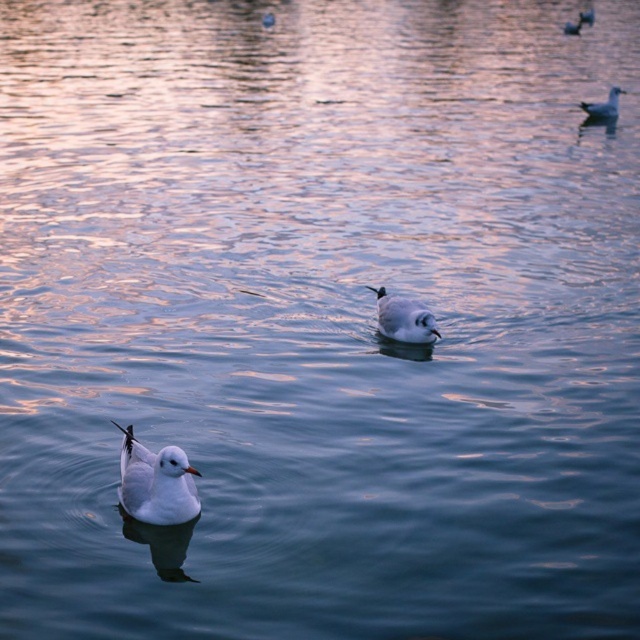
Question: Which is farther from the white matte bird at upper right?

Choices:
 (A) white matte bird at center
 (B) white matte duck at lower left

Answer: (B)

Question: Can you confirm if white matte bird at center is smaller than white matte bird at upper right?

Choices:
 (A) no
 (B) yes

Answer: (B)

Question: Which object appears farthest from the camera in this image?

Choices:
 (A) white matte duck at lower left
 (B) white matte bird at upper right
 (C) white matte bird at center

Answer: (B)

Question: Which object is positioned farthest from the white matte bird at center?

Choices:
 (A) white matte duck at lower left
 (B) white matte bird at upper right

Answer: (B)

Question: Is white matte bird at center bigger than white matte bird at upper right?

Choices:
 (A) yes
 (B) no

Answer: (B)

Question: Observing the image, what is the correct spatial positioning of white matte duck at lower left in reference to white matte bird at upper right?

Choices:
 (A) right
 (B) left

Answer: (B)